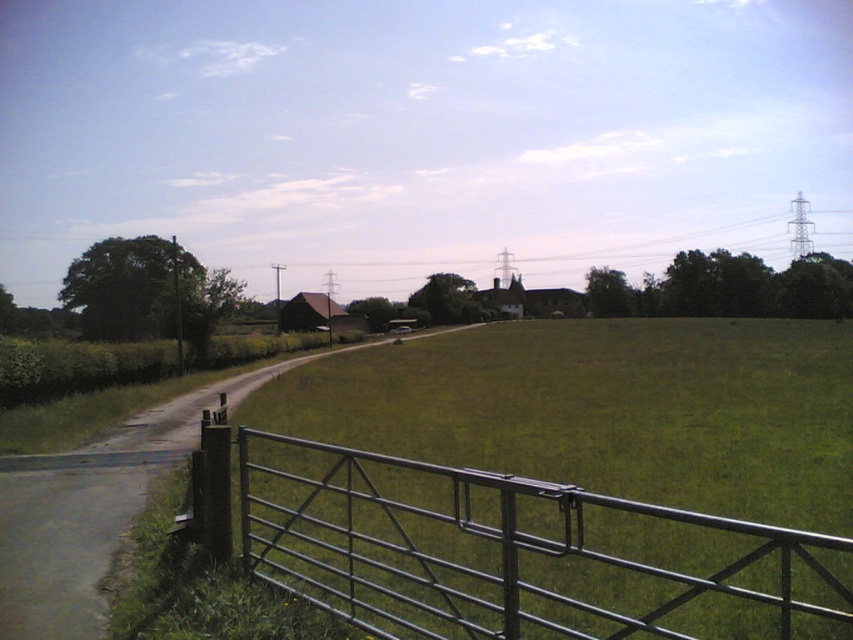
Question: Does metallic gate at lower center lie behind smooth asphalt road at center?

Choices:
 (A) yes
 (B) no

Answer: (B)

Question: Is metallic gate at lower center to the right of smooth asphalt road at center from the viewer's perspective?

Choices:
 (A) yes
 (B) no

Answer: (A)

Question: Which object appears farthest from the camera in this image?

Choices:
 (A) smooth asphalt road at center
 (B) metallic gate at lower center

Answer: (A)

Question: Is metallic gate at lower center closer to the viewer compared to smooth asphalt road at center?

Choices:
 (A) yes
 (B) no

Answer: (A)